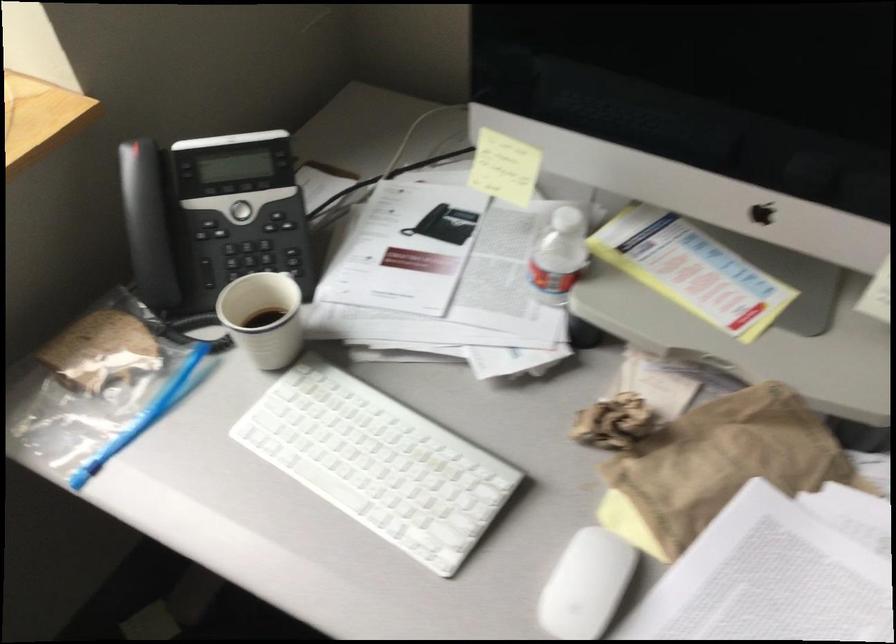
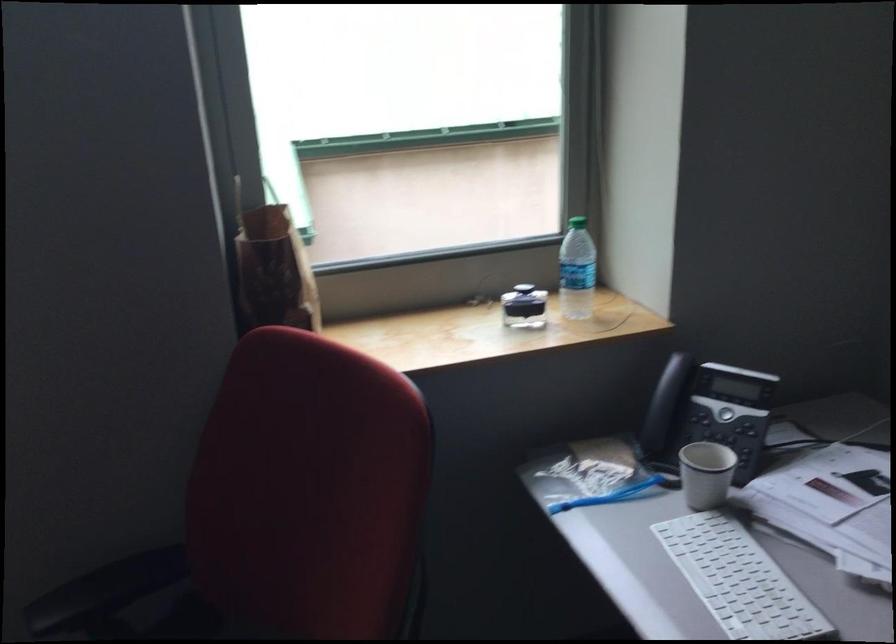
Locate, in the second image, the point that corresponds to pixel 254 327 in the first image.

(705, 474)